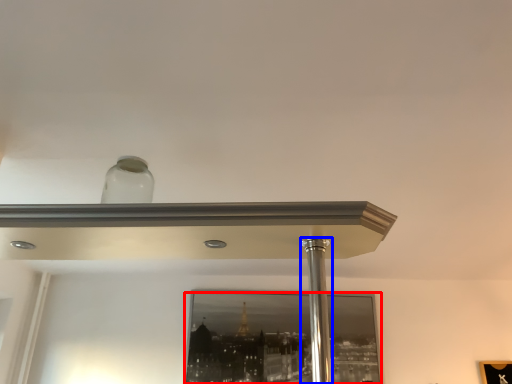
Question: Among these objects, which one is nearest to the camera, mirror (highlighted by a red box) or pillar (highlighted by a blue box)?

Choices:
 (A) mirror
 (B) pillar

Answer: (B)